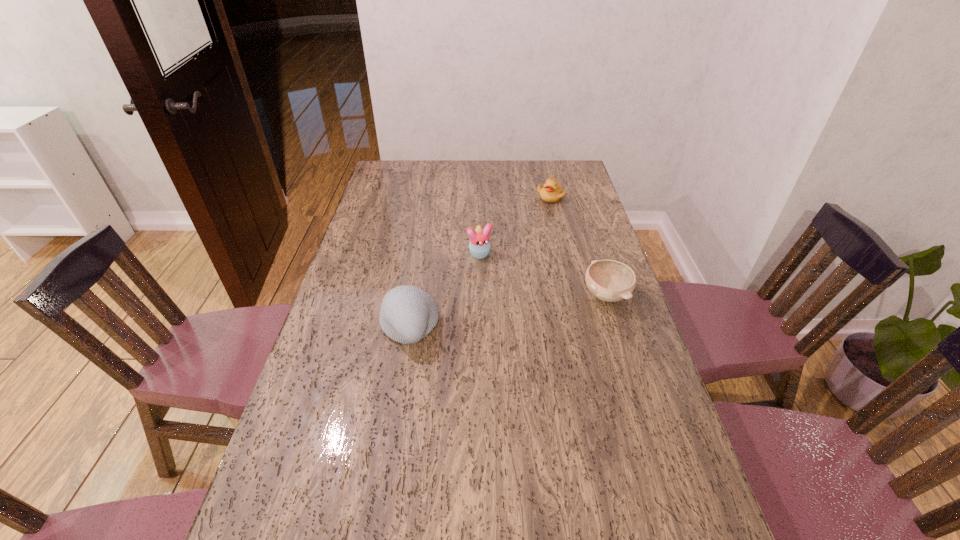
Where is `vacant point located on the face of the cupcake`? Image resolution: width=960 pixels, height=540 pixels. vacant point located on the face of the cupcake is located at coordinates (507, 307).

At what (x,y) coordinates should I click in order to perform the action: click on free region located on the face of the cupcake. Please return your answer as a coordinate pair (x, y). The width and height of the screenshot is (960, 540). Looking at the image, I should click on (490, 270).

Where is `vacant space located 0.170m on the face of the cupcake`? vacant space located 0.170m on the face of the cupcake is located at coordinates (500, 294).

Locate an element on the screen. The height and width of the screenshot is (540, 960). object located at the left edge is located at coordinates (408, 314).

Image resolution: width=960 pixels, height=540 pixels. Identify the location of bowl located at the right edge. (608, 280).

Where is `duckling that is at the right edge`? Image resolution: width=960 pixels, height=540 pixels. duckling that is at the right edge is located at coordinates (552, 192).

I want to click on free space at the far edge, so click(x=484, y=160).

The width and height of the screenshot is (960, 540). I want to click on vacant area at the left edge of the desktop, so click(x=357, y=318).

I want to click on free space at the right edge, so click(x=567, y=242).

Find the location of a particular element. The image size is (960, 540). vacant space at the far left corner of the desktop is located at coordinates (399, 183).